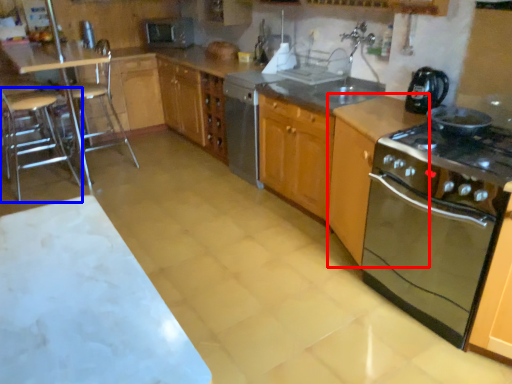
Question: Which point is further to the camera, cabinetry (highlighted by a red box) or bar stool (highlighted by a blue box)?

Choices:
 (A) cabinetry
 (B) bar stool

Answer: (B)